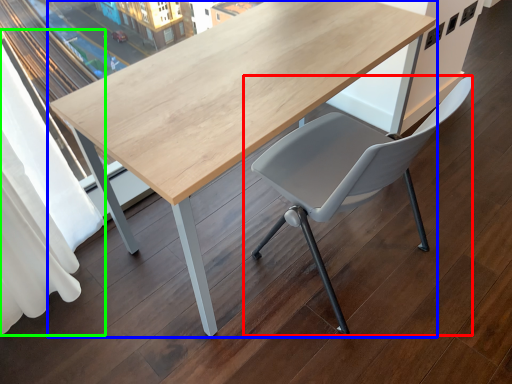
Question: Which object is the farthest from chair (highlighted by a red box)? Choose among these: table (highlighted by a blue box) or curtain (highlighted by a green box).

Choices:
 (A) table
 (B) curtain

Answer: (B)